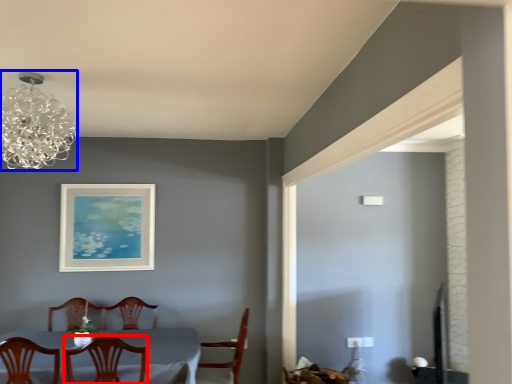
Question: Which object appears farthest to the camera in this image, chair (highlighted by a red box) or lamp (highlighted by a blue box)?

Choices:
 (A) chair
 (B) lamp

Answer: (A)